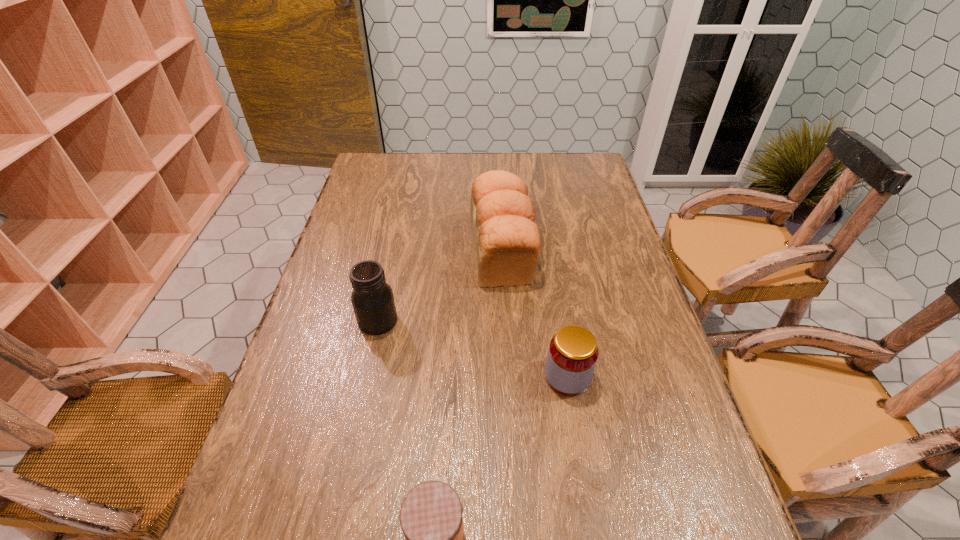
This screenshot has height=540, width=960. In order to click on bread in this screenshot , I will do (x=506, y=242).

This screenshot has height=540, width=960. Find the location of `the leftmost object`. the leftmost object is located at coordinates [x=372, y=299].

At what (x,y) coordinates should I click in order to perform the action: click on the second tallest object. Please return your answer as a coordinate pair (x, y). This screenshot has height=540, width=960. Looking at the image, I should click on (372, 299).

Identify the location of the second nearest jar. (572, 356).

The height and width of the screenshot is (540, 960). I want to click on the rightmost jar, so click(x=572, y=356).

At what (x,y) coordinates should I click in order to perform the action: click on free space located on the back of the bread. Please return your answer as a coordinate pair (x, y). Image resolution: width=960 pixels, height=540 pixels. Looking at the image, I should click on pyautogui.click(x=498, y=198).

This screenshot has width=960, height=540. I want to click on free region located on the front of the farthest jar, so click(x=352, y=438).

Where is `vacant area situated 0.250m on the front of the third farthest object`? Image resolution: width=960 pixels, height=540 pixels. vacant area situated 0.250m on the front of the third farthest object is located at coordinates pos(590,517).

Image resolution: width=960 pixels, height=540 pixels. Find the location of `object that is at the left edge`. object that is at the left edge is located at coordinates (372, 299).

The height and width of the screenshot is (540, 960). Identify the location of free spot at the far edge of the desktop. (476, 170).